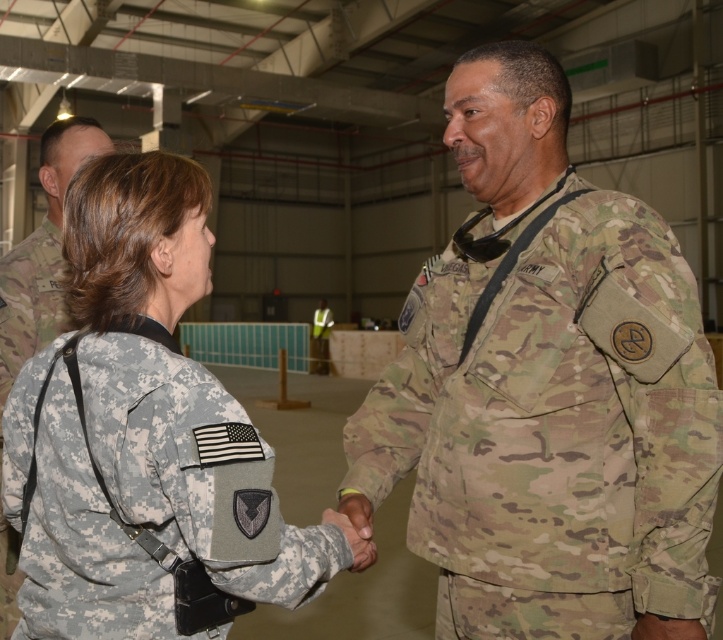
Question: Based on their relative distances, which object is nearer to the camo uniform at center?

Choices:
 (A) camouflage uniform at center
 (B) camouflage fabric uniform at center

Answer: (B)

Question: Among these objects, which one is farthest from the camera?

Choices:
 (A) camo uniform at center
 (B) camouflage uniform at center
 (C) camouflage fabric uniform at center

Answer: (B)

Question: Is camo uniform at center in front of camouflage fabric uniform at center?

Choices:
 (A) no
 (B) yes

Answer: (A)

Question: Considering the relative positions of camo uniform at center and camouflage uniform at center in the image provided, where is camo uniform at center located with respect to camouflage uniform at center?

Choices:
 (A) above
 (B) below

Answer: (B)

Question: Does camouflage fabric uniform at center have a greater width compared to camouflage uniform at center?

Choices:
 (A) no
 (B) yes

Answer: (A)

Question: Estimate the real-world distances between objects in this image. Which object is closer to the camo uniform at center?

Choices:
 (A) camouflage uniform at center
 (B) camouflage fabric uniform at center

Answer: (B)